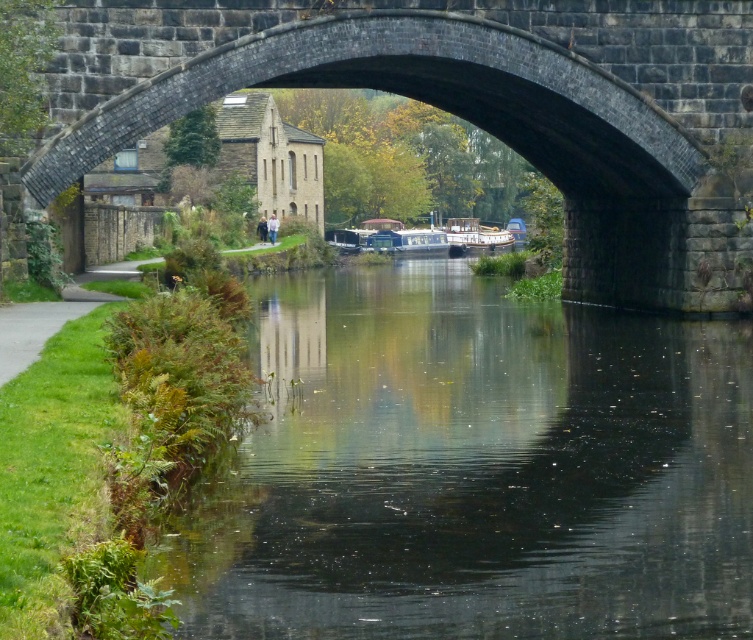
Question: Is transparent water at center to the right of dark gray stone bridge at center from the viewer's perspective?

Choices:
 (A) yes
 (B) no

Answer: (B)

Question: Which object appears farthest from the camera in this image?

Choices:
 (A) transparent water at center
 (B) wooden polished boat at center
 (C) dark gray stone bridge at center

Answer: (B)

Question: Can you confirm if dark gray stone bridge at center is positioned to the right of wooden polished boat at center?

Choices:
 (A) yes
 (B) no

Answer: (B)

Question: In this image, where is dark gray stone bridge at center located relative to wooden polished boat at center?

Choices:
 (A) below
 (B) above

Answer: (A)

Question: Which object is positioned closest to the wooden polished boat at center?

Choices:
 (A) transparent water at center
 (B) dark gray stone bridge at center

Answer: (B)

Question: Which object is the closest to the wooden polished boat at center?

Choices:
 (A) transparent water at center
 (B) dark gray stone bridge at center

Answer: (B)